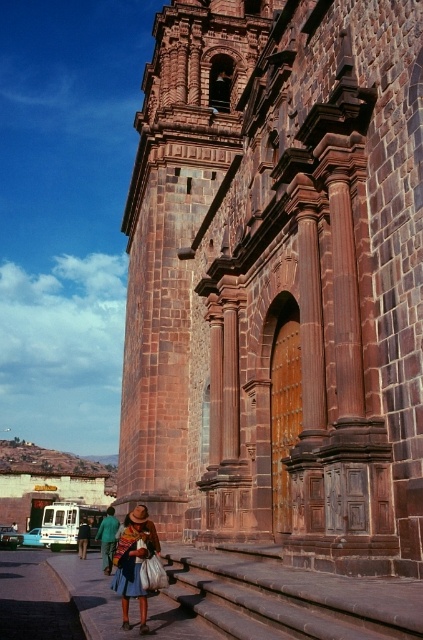
Can you confirm if brown stone church at center is positioned below brown stone stairs at lower center?

No, brown stone church at center is not below brown stone stairs at lower center.

Is point (302, 333) in front of point (209, 577)?

Yes, point (302, 333) is in front of point (209, 577).

Is point (338, 157) in front of point (260, 573)?

That is False.

Locate an element on the screen. brown stone church at center is located at coordinates (279, 280).

This screenshot has height=640, width=423. What do you see at coordinates (288, 596) in the screenshot? I see `brown stone stairs at lower center` at bounding box center [288, 596].

What do you see at coordinates (288, 596) in the screenshot? The width and height of the screenshot is (423, 640). I see `brown stone stairs at lower center` at bounding box center [288, 596].

In order to click on brown stone stairs at lower center in this screenshot , I will do `click(288, 596)`.

Between brown stone church at center and blue woven skirt at lower center, which one is positioned lower?

blue woven skirt at lower center is below.

Is brown stone church at center shorter than blue woven skirt at lower center?

No, brown stone church at center is not shorter than blue woven skirt at lower center.

Consider the image. Who is more distant from viewer, (x=282, y=42) or (x=143, y=560)?

The point (x=282, y=42) is behind.

The width and height of the screenshot is (423, 640). Identify the location of brown stone church at center. (279, 280).